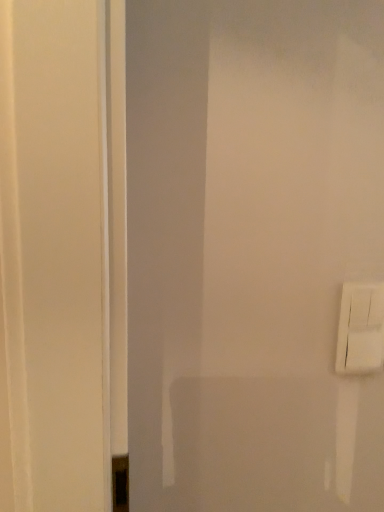
You are a GUI agent. You are given a task and a screenshot of the screen. Output one action in this format:
    pyautogui.click(x=<x>, y=<y>)
    Task: Click on the white plastic light switch at right
    This screenshot has width=384, height=512.
    Given the screenshot: What is the action you would take?
    pyautogui.click(x=360, y=328)

Describe the element at coordinates (360, 328) in the screenshot. This screenshot has height=512, width=384. I see `white plastic light switch at right` at that location.

Find the location of `white plastic light switch at right`. white plastic light switch at right is located at coordinates (360, 328).